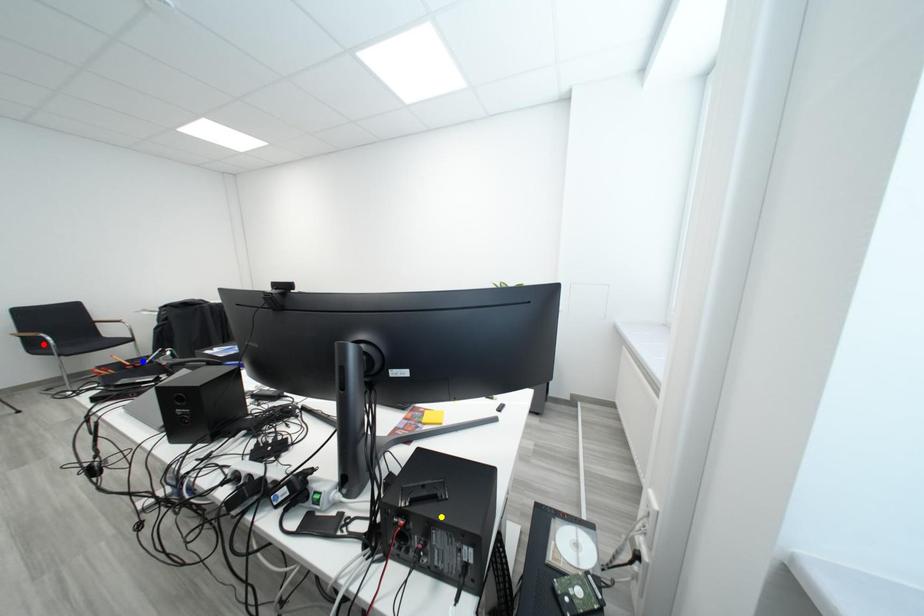
Order these from nearest to farthest:
A) blue point
B) red point
C) yellow point

yellow point, blue point, red point